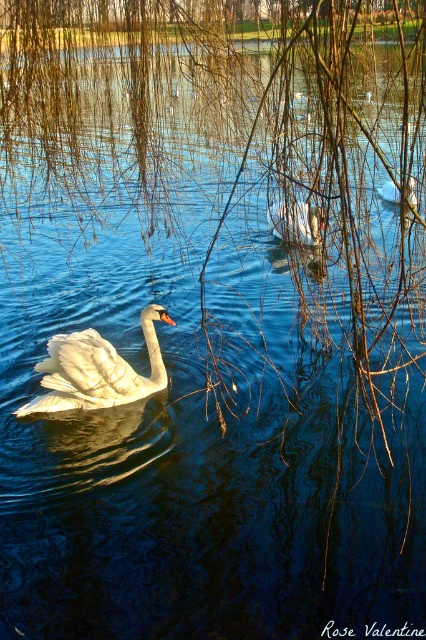
Question: Which object is farther from the camera taking this photo?

Choices:
 (A) white glossy swan at center
 (B) white matte goose at center

Answer: (B)

Question: Considering the real-world distances, which object is closest to the white glossy swan at center?

Choices:
 (A) white matte duck at center
 (B) white matte goose at center

Answer: (B)

Question: Can you confirm if white glossy swan at center is positioned to the left of white matte goose at center?

Choices:
 (A) no
 (B) yes

Answer: (B)

Question: Which object is the farthest from the white glossy swan at center?

Choices:
 (A) white matte goose at center
 (B) white matte duck at center

Answer: (B)

Question: Where is white glossy swan at center located in relation to white matte duck at center in the image?

Choices:
 (A) right
 (B) left

Answer: (B)

Question: Does white glossy swan at center appear on the left side of white matte goose at center?

Choices:
 (A) yes
 (B) no

Answer: (A)